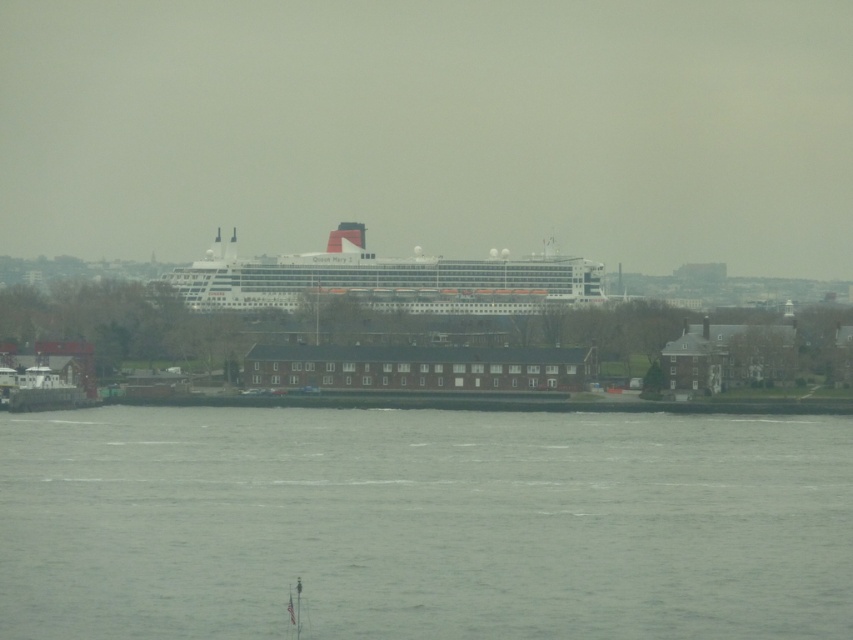
Looking at this image, is gray water at lower center shorter than white glossy cruise ship at center?

Correct, gray water at lower center is not as tall as white glossy cruise ship at center.

Does gray water at lower center come behind white glossy cruise ship at center?

No, it is in front of white glossy cruise ship at center.

Which is in front, point (473, 592) or point (294, 289)?

Positioned in front is point (473, 592).

The image size is (853, 640). Find the location of `gray water at lower center`. gray water at lower center is located at coordinates (422, 524).